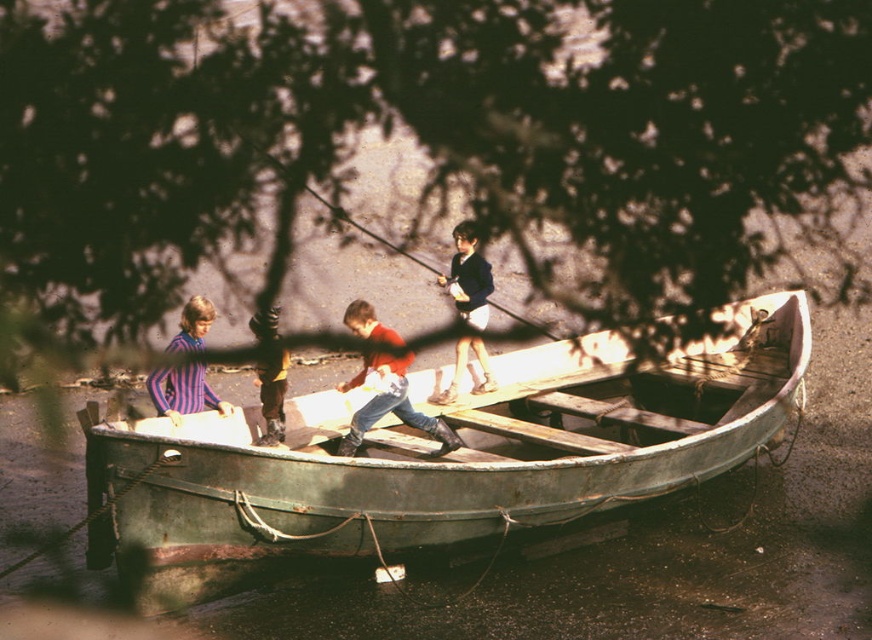
Does point (407, 420) lie in front of point (223, 401)?

Yes.

Who is positioned more to the right, red matte shirt at center or striped fabric shirt at left?

Positioned to the right is red matte shirt at center.

Is point (385, 372) positioned before point (169, 390)?

Yes, it is.

In order to click on red matte shirt at center in this screenshot , I will do pos(390,403).

In the scene shown: Between striped fabric shirt at left and yellow fabric pants at center, which one has more height?

yellow fabric pants at center is taller.

Between point (208, 403) and point (257, 340), which one is positioned in front?

Point (208, 403) is in front.

Who is more forward, (189, 390) or (271, 378)?

Point (189, 390) is in front.

Find the location of `striped fabric shirt at left`. striped fabric shirt at left is located at coordinates (182, 392).

Who is positioned more to the right, dark blue sweater at center or striped fabric shirt at left?

Positioned to the right is dark blue sweater at center.

Which of these two, dark blue sweater at center or striped fabric shirt at left, stands shorter?

With less height is striped fabric shirt at left.

What are the coordinates of `dark blue sweater at center` in the screenshot? It's located at (468, 276).